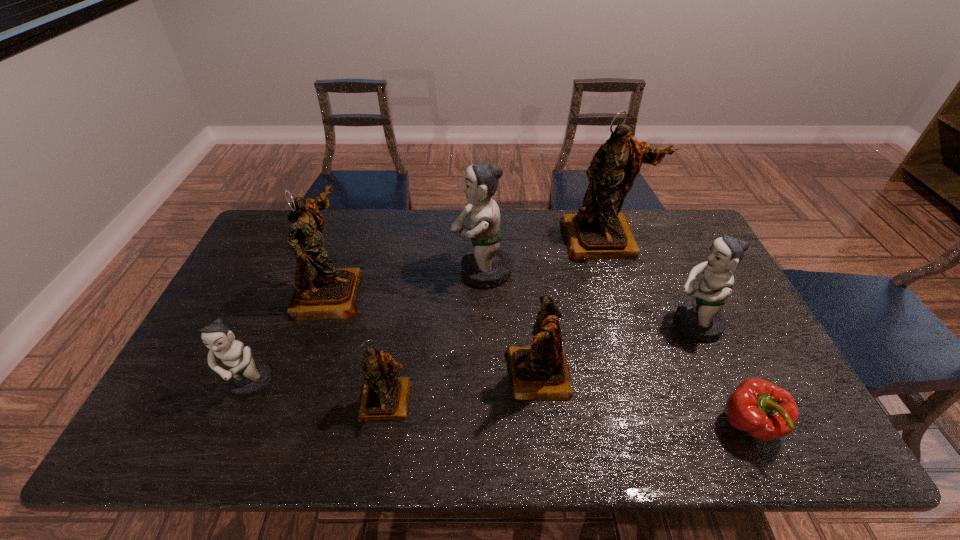
This screenshot has height=540, width=960. Find the location of `vacant region that satisfies the following two spatial constraints: 1. on the front-facing side of the tallest figurine; 2. on the front-facing side of the biggest green figurine`. vacant region that satisfies the following two spatial constraints: 1. on the front-facing side of the tallest figurine; 2. on the front-facing side of the biggest green figurine is located at coordinates (612, 271).